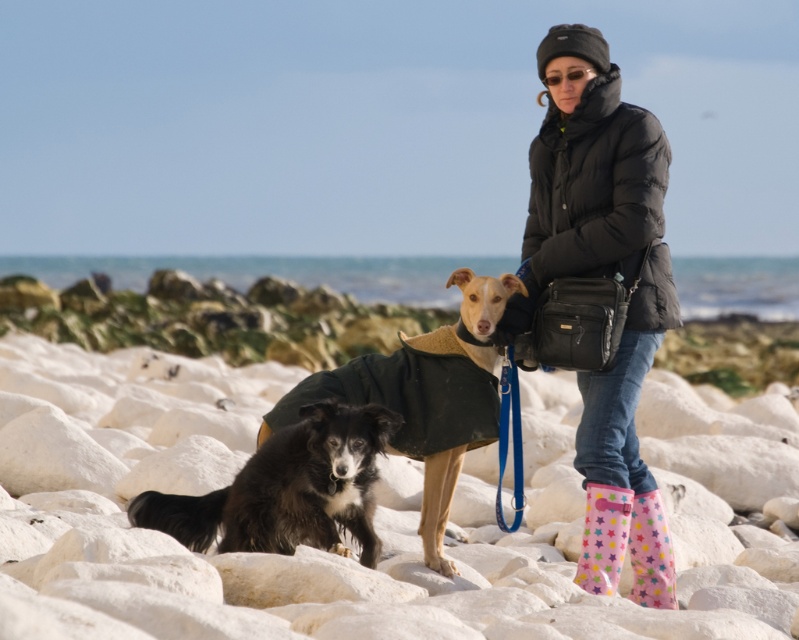
You are a photographer trying to capture the black puffer jacket at center and the white smooth rocks at center in the same frame. Since the camera has a limited field of view, you need to know which object is wider to adjust your framing. Which object has a greater width?

The white smooth rocks at center has a greater width than the black puffer jacket at center according to the description.

You are standing on the beach and see the white smooth rocks at center and the black puffer jacket at center. Which object is closer to you?

The white smooth rocks at center are closer to you because they are positioned in front of the black puffer jacket at center.

You are a photographer standing at the edge of the beach. You want to take a picture of the black puffer jacket at center. Where should you aim your camera to capture it?

You should aim your camera at point 0.434 on the horizontal axis and 0.758 on the vertical axis to capture the black puffer jacket at center.